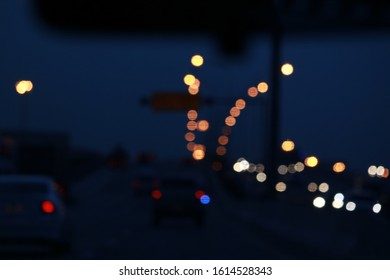
Find the location of `light`. light is located at coordinates click(48, 205).